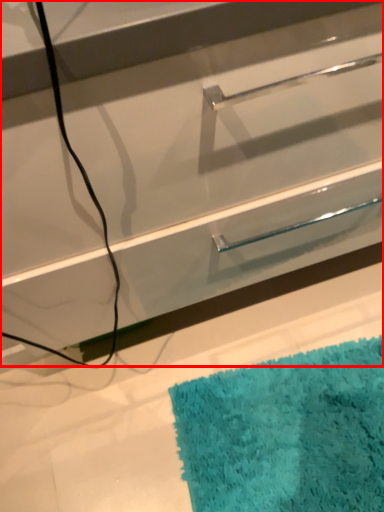
Question: From the image's perspective, what is the correct spatial relationship of drawer (annotated by the red box) in relation to bath mat?

Choices:
 (A) above
 (B) below

Answer: (A)